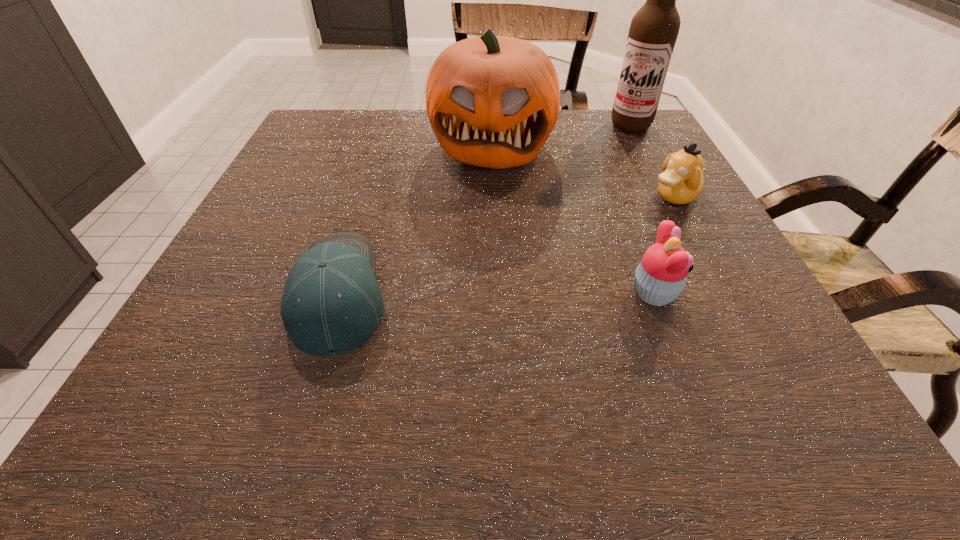
I want to click on vacant region between the duckling and the alcohol, so click(x=653, y=161).

I want to click on empty space between the third nearest object and the pumpkin, so click(583, 170).

At what (x,y) coordinates should I click in order to perform the action: click on free space between the third object from right to left and the shortest object. Please return your answer as a coordinate pair (x, y). The height and width of the screenshot is (540, 960). Looking at the image, I should click on (497, 293).

Select which object appears as the second closest to the third object from right to left. Please provide its 2D coordinates. Your answer should be formatted as a tuple, i.e. [(x, y)], where the tuple contains the x and y coordinates of a point satisfying the conditions above.

[(492, 101)]

At what (x,y) coordinates should I click in order to perform the action: click on object that stands as the second closest to the cupcake. Please return your answer as a coordinate pair (x, y). This screenshot has height=540, width=960. Looking at the image, I should click on (492, 101).

I want to click on vacant point that satisfies the following two spatial constraints: 1. on the back side of the fourth shortest object; 2. on the left side of the shortest object, so click(x=386, y=143).